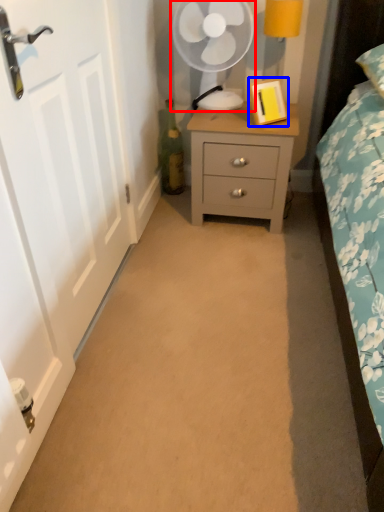
Question: Which object is further to the camera taking this photo, mechanical fan (highlighted by a red box) or picture frame (highlighted by a blue box)?

Choices:
 (A) mechanical fan
 (B) picture frame

Answer: (A)